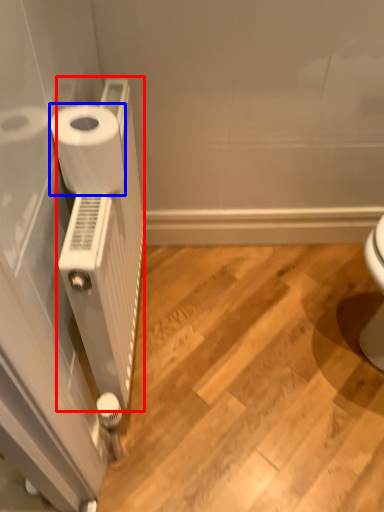
Question: Among these objects, which one is nearest to the camera, radiator (highlighted by a red box) or toilet paper (highlighted by a blue box)?

Choices:
 (A) radiator
 (B) toilet paper

Answer: (A)